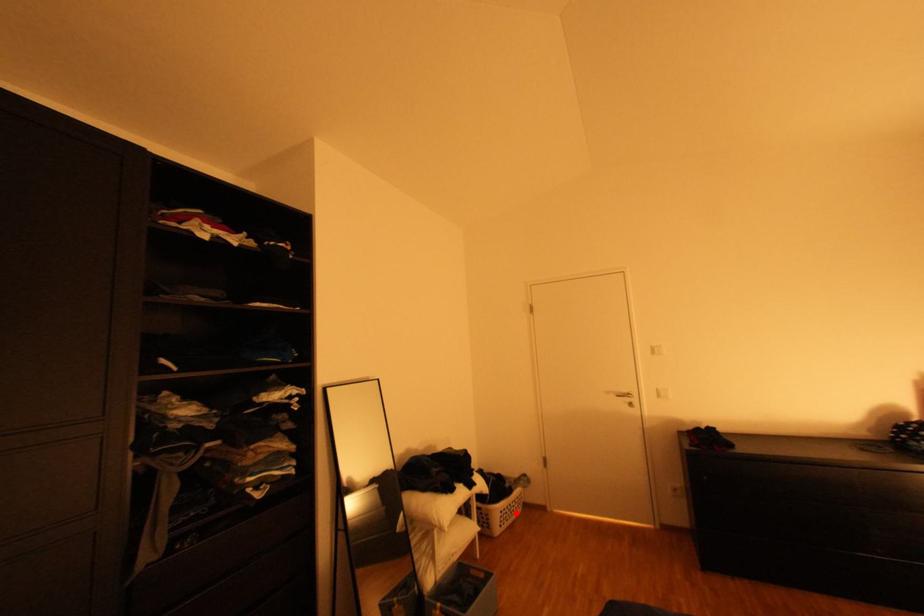
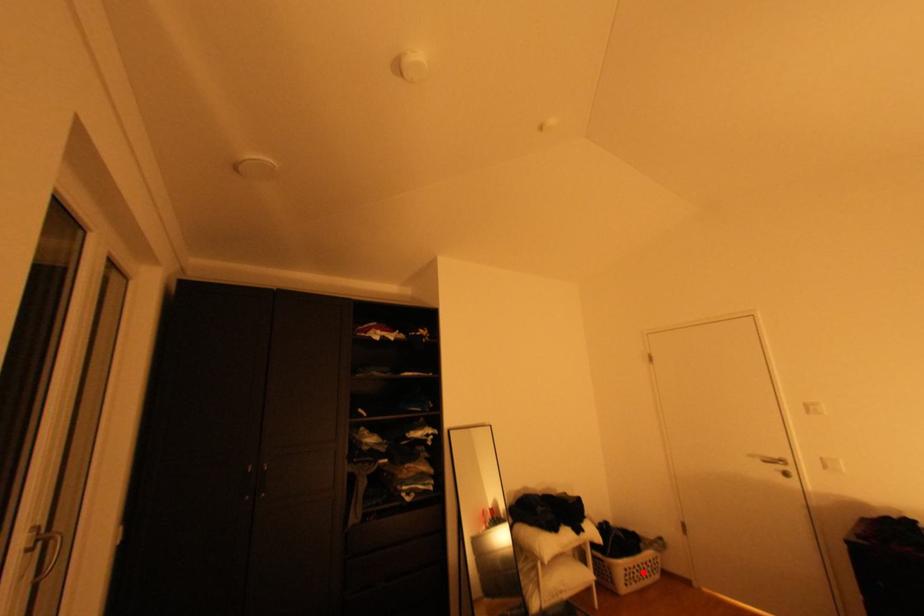
I am providing you with two images of the same scene from different viewpoints. A red point is marked on the first image and another point is marked on the second image. Is the marked point in image1 the same physical position as the marked point in image2?

Yes